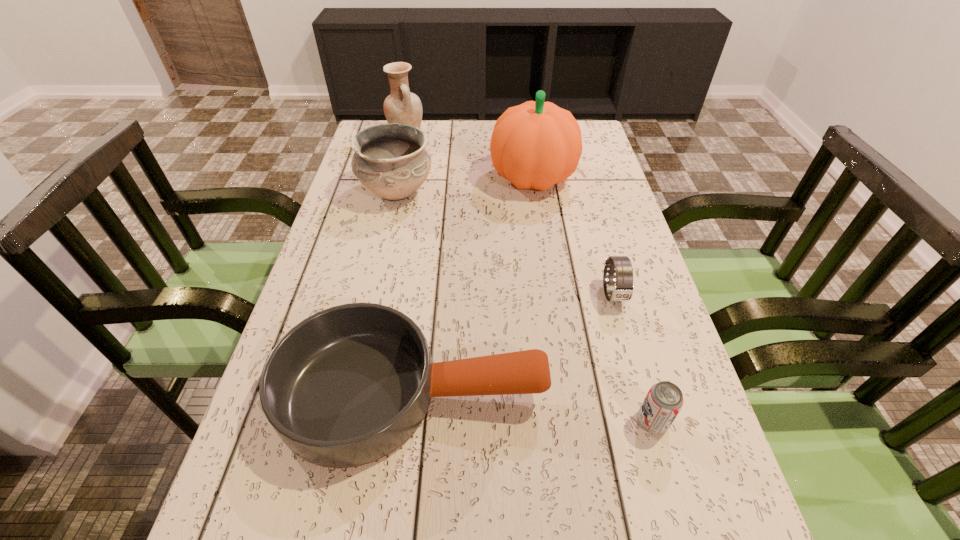
Locate an element on the screen. This screenshot has width=960, height=540. vacant region between the second tallest object and the pumpkin is located at coordinates (469, 157).

Identify the location of free space between the third nearest object and the shorter pottery. Image resolution: width=960 pixels, height=540 pixels. (505, 244).

You are a GUI agent. You are given a task and a screenshot of the screen. Output one action in this format:
    pyautogui.click(x=<x>, y=<y>)
    Task: Click on the vacant area that lies between the tallest object and the beer can
    The height and width of the screenshot is (540, 960).
    Given the screenshot: What is the action you would take?
    pyautogui.click(x=592, y=300)

The height and width of the screenshot is (540, 960). I want to click on free space between the pumpkin and the farthest object, so click(469, 157).

Point out which object is positioned as the fourth nearest to the pumpkin. Please provide its 2D coordinates. Your answer should be formatted as a tuple, i.e. [(x, y)], where the tuple contains the x and y coordinates of a point satisfying the conditions above.

[(347, 386)]

Point out which object is positioned as the nearest to the watch. Please provide its 2D coordinates. Your answer should be formatted as a tuple, i.e. [(x, y)], where the tuple contains the x and y coordinates of a point satisfying the conditions above.

[(347, 386)]

Where is `vacant area that satisfies the following two spatial constraints: 1. on the handle side of the beer can; 2. on the right side of the pan`? The height and width of the screenshot is (540, 960). vacant area that satisfies the following two spatial constraints: 1. on the handle side of the beer can; 2. on the right side of the pan is located at coordinates (410, 421).

At what (x,y) coordinates should I click in order to perform the action: click on blank space that satisfies the following two spatial constraints: 1. on the face of the watch; 2. on the handle side of the pan. Please return your answer as a coordinate pair (x, y). The height and width of the screenshot is (540, 960). Looking at the image, I should click on (640, 394).